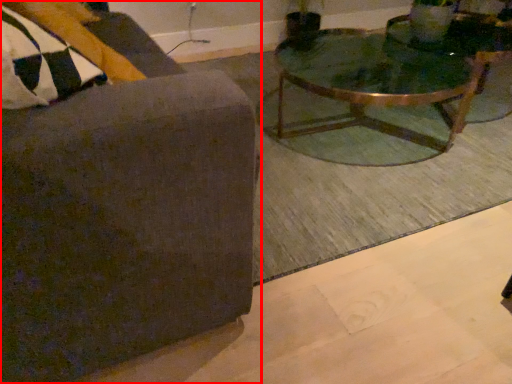
Question: Considering the relative positions of chair (annotated by the red box) and coffee table in the image provided, where is chair (annotated by the red box) located with respect to the staircase?

Choices:
 (A) left
 (B) right

Answer: (A)